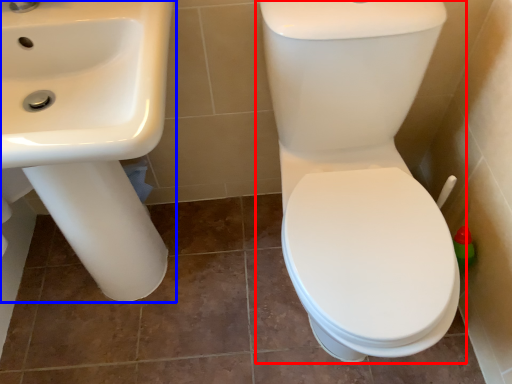
Question: Which point is closer to the camera, toilet (highlighted by a red box) or sink (highlighted by a blue box)?

Choices:
 (A) toilet
 (B) sink

Answer: (A)